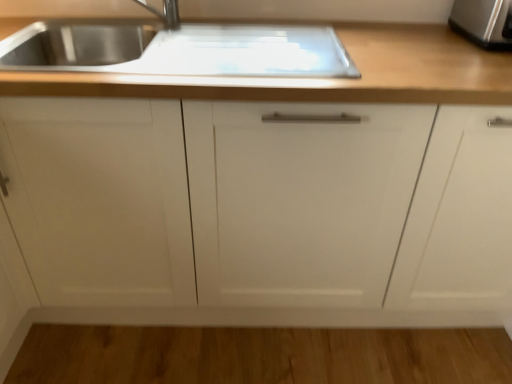
Question: From a real-world perspective, is wooden countertop at upper center physically located above or below white matte cabinet at center?

Choices:
 (A) above
 (B) below

Answer: (A)

Question: Considering the relative positions of wooden countertop at upper center and white matte cabinet at center in the image provided, is wooden countertop at upper center to the left or to the right of white matte cabinet at center?

Choices:
 (A) left
 (B) right

Answer: (A)

Question: Which is nearer to the stainless steel toaster at upper right?

Choices:
 (A) white matte cabinet at center
 (B) wooden countertop at upper center

Answer: (B)

Question: Based on their relative distances, which object is nearer to the wooden countertop at upper center?

Choices:
 (A) white matte cabinet at center
 (B) stainless steel toaster at upper right

Answer: (A)